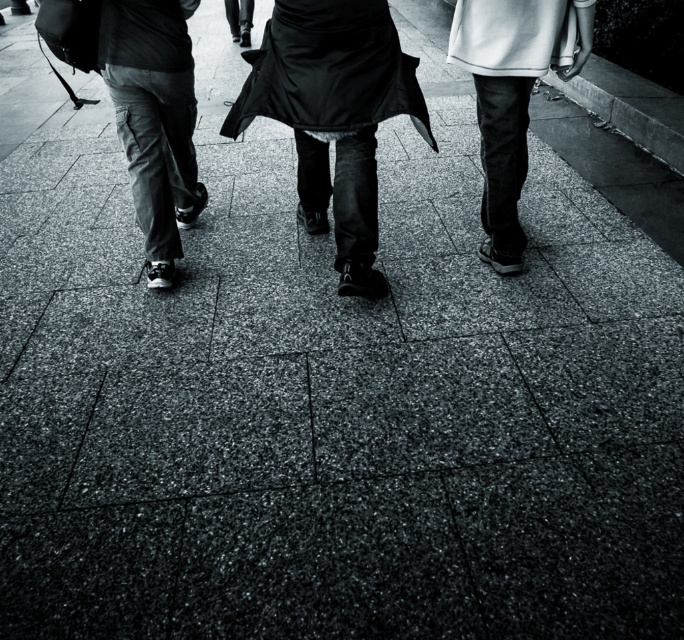
Between point (354, 220) and point (129, 148), which one is positioned behind?

The point (129, 148) is behind.

Identify the location of matte black skirt at center. The width and height of the screenshot is (684, 640). (332, 115).

In the scene shown: Is matte black skirt at center positioned at the back of smooth black pants at right?

That is False.

Is matte black skirt at center to the left of smooth black pants at right from the viewer's perspective?

Indeed, matte black skirt at center is positioned on the left side of smooth black pants at right.

Does point (355, 170) lie behind point (518, 134)?

No, it is in front of (518, 134).

Where is `matte black skirt at center`? matte black skirt at center is located at coordinates (332, 115).

Between point (127, 92) and point (488, 45), which one is positioned in front?

Point (488, 45) is more forward.

Find the location of a particular element. The height and width of the screenshot is (640, 684). dark gray cargo pants at left is located at coordinates (155, 118).

Between point (133, 51) and point (499, 77), which one is positioned behind?

The point (133, 51) is behind.

You are a GUI agent. You are given a task and a screenshot of the screen. Output one action in this format:
    pyautogui.click(x=<x>, y=<y>)
    Task: Click on the dark gray cargo pants at left
    Image resolution: width=684 pixels, height=640 pixels.
    Given the screenshot: What is the action you would take?
    pyautogui.click(x=155, y=118)